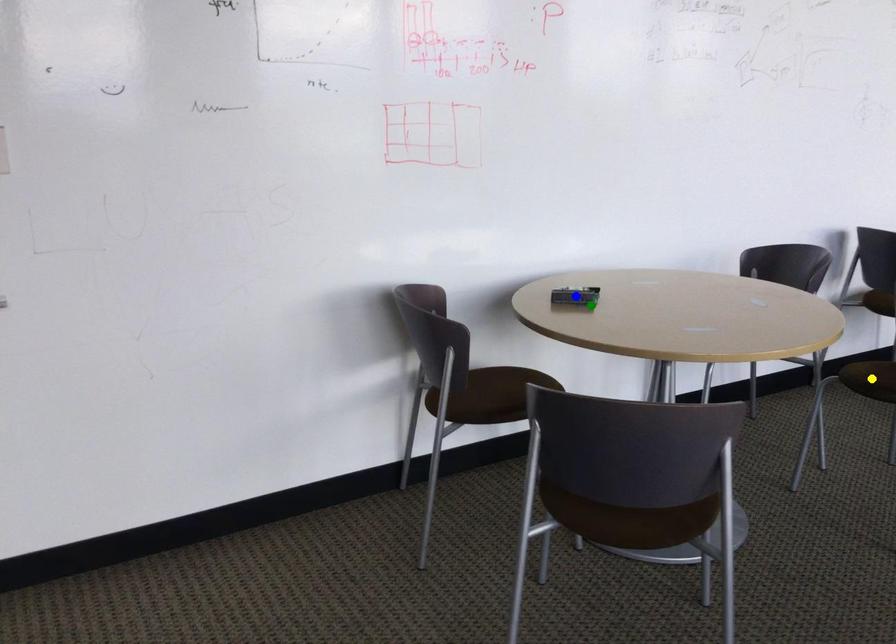
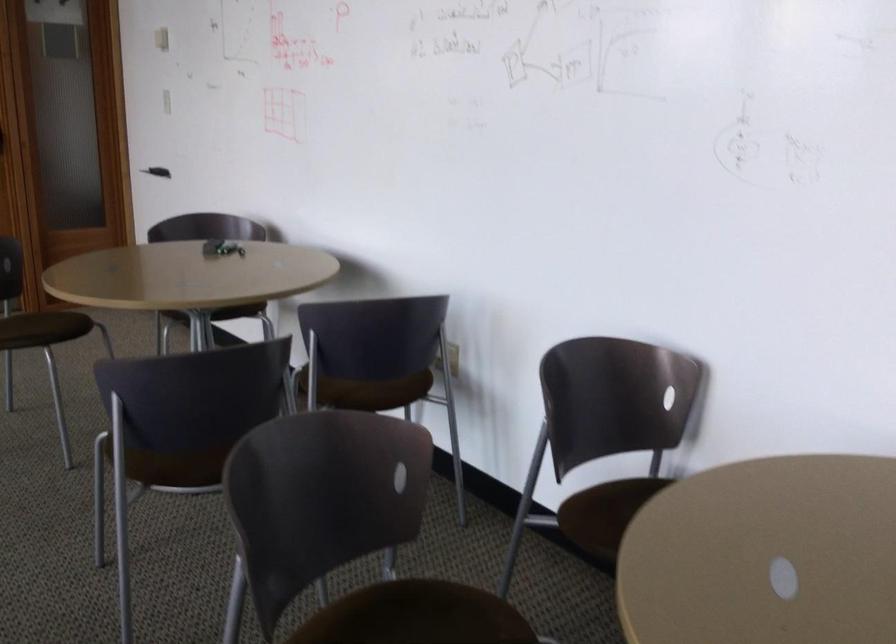
I am providing you with two images of the same scene from different viewpoints. Three points are marked in image1. Which point corresponds to a part or object that is occluded in image2?In image1, three points are marked. Which of them correspond to a part or object that is occluded in image2?Among the three points shown in image1, which one corresponds to a part or object that is no longer visible due to occlusion in image2?

blue point, yellow point cannot be seen in image2.